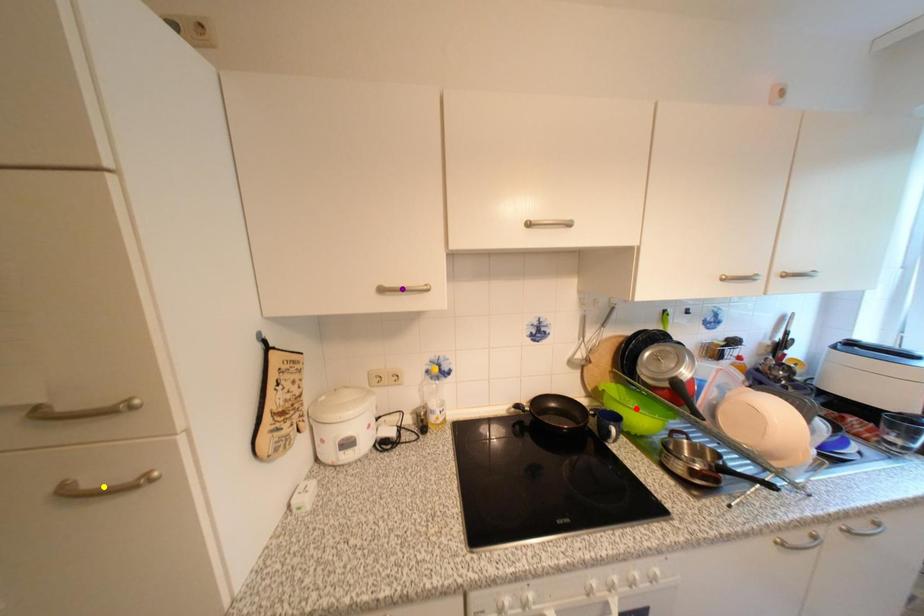
From the picture: Order these from farthest to nearest:
- red point
- yellow point
- purple point

red point < purple point < yellow point